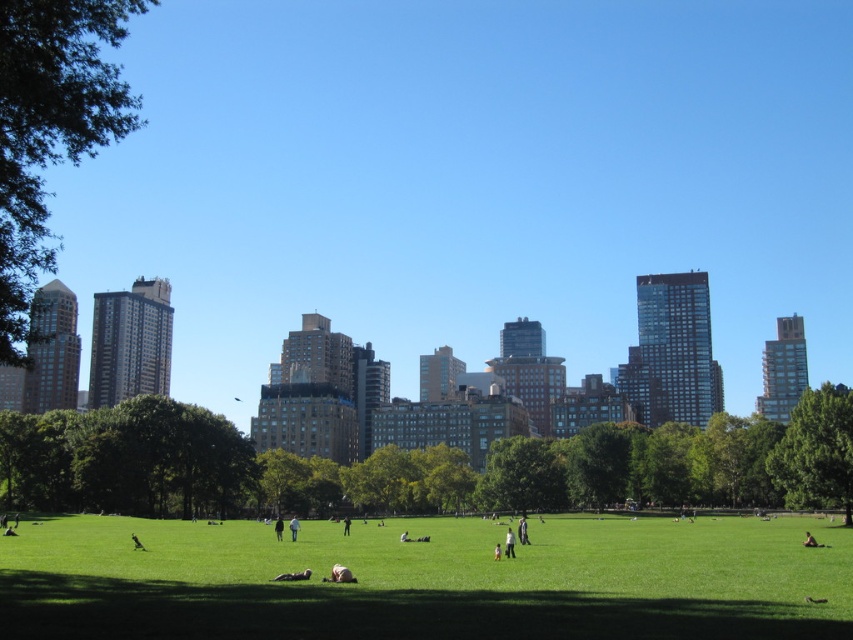
Who is positioned more to the left, green leafy tree at upper left or dark gray jacket at center?

green leafy tree at upper left is more to the left.

Does green leafy tree at upper left have a greater width compared to dark gray jacket at center?

Yes.

Between point (3, 97) and point (347, 525), which one is positioned in front?

Positioned in front is point (3, 97).

Locate an element on the screen. The height and width of the screenshot is (640, 853). green leafy tree at upper left is located at coordinates (50, 125).

Is green leafy tree at upper left thinner than light brown hair at center?

In fact, green leafy tree at upper left might be wider than light brown hair at center.

Identify the location of green leafy tree at upper left. The height and width of the screenshot is (640, 853). (50, 125).

Is point (86, 74) positioned after point (512, 554)?

No, (86, 74) is in front of (512, 554).

Identify the location of green leafy tree at upper left. (50, 125).

Who is higher up, green leafy tree at lower left or green leafy tree at center-right?

green leafy tree at center-right

Between point (622, 428) and point (791, 454), which one is positioned behind?

Point (622, 428)

Identify the location of green leafy tree at lower left. (421, 465).